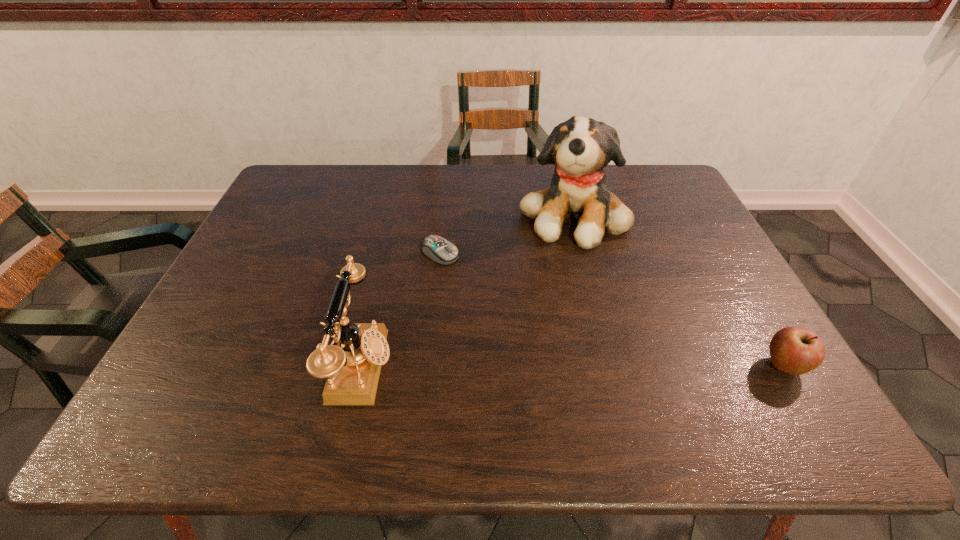
Locate an element on the screen. vacant spot on the desktop that is between the leftmost object and the rightmost object and is positioned at the face of the puppy is located at coordinates (593, 367).

Where is `free space on the desktop that is between the second tallest object and the second shortest object and is positioned on the wheel side of the shortest object`? This screenshot has height=540, width=960. free space on the desktop that is between the second tallest object and the second shortest object and is positioned on the wheel side of the shortest object is located at coordinates (636, 367).